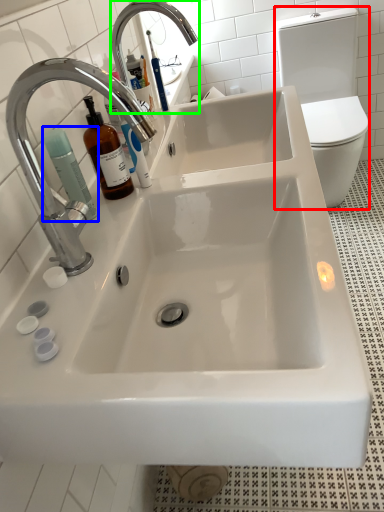
Question: Which object is positioned closest to toilet bowl (highlighted by a red box)? Select from cleaning product (highlighted by a blue box) and tap (highlighted by a green box).

Choices:
 (A) cleaning product
 (B) tap

Answer: (B)